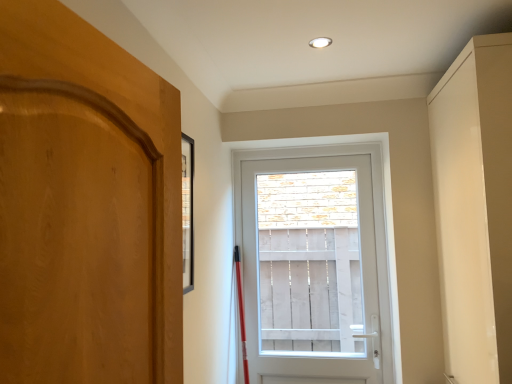
Question: From the image's perspective, is matte beige cabinet at right above or below white plastic door at center?

Choices:
 (A) below
 (B) above

Answer: (B)

Question: Relative to white plastic door at center, is matte beige cabinet at right in front or behind?

Choices:
 (A) front
 (B) behind

Answer: (A)

Question: Is point (480, 319) positioned closer to the camera than point (391, 213)?

Choices:
 (A) farther
 (B) closer

Answer: (B)

Question: In the image, is white plastic door at center positioned in front of or behind matte beige cabinet at right?

Choices:
 (A) behind
 (B) front

Answer: (A)

Question: Visually, is white plastic door at center positioned to the left or to the right of matte beige cabinet at right?

Choices:
 (A) right
 (B) left

Answer: (B)

Question: In terms of size, does white plastic door at center appear bigger or smaller than matte beige cabinet at right?

Choices:
 (A) small
 (B) big

Answer: (A)

Question: Is white plastic door at center inside the boundaries of matte beige cabinet at right, or outside?

Choices:
 (A) outside
 (B) inside

Answer: (A)